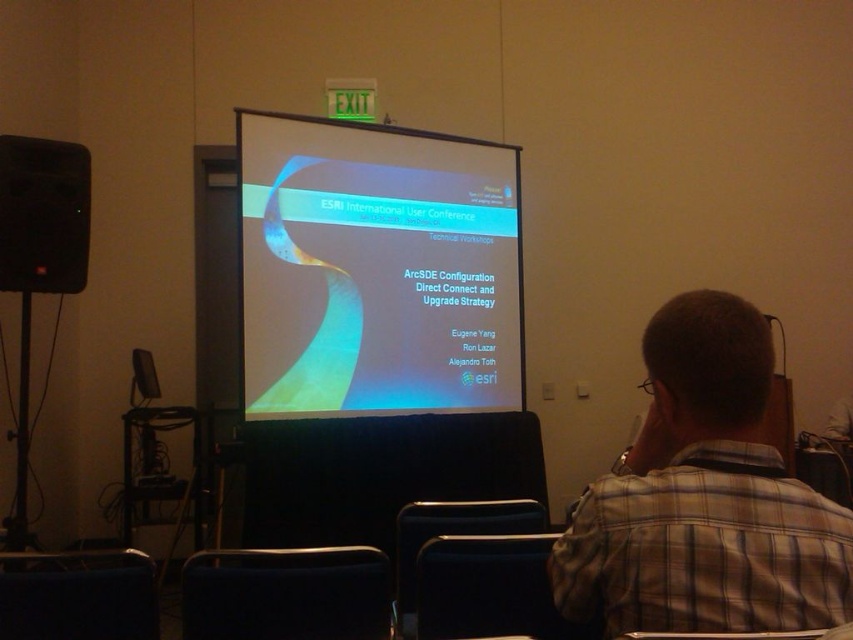
You are attending a conference and see a person in a plaid shirt at center and a black matte speaker at left. From your perspective, which object is positioned to the right?

The plaid shirt at center is positioned to the right of the black matte speaker at left.